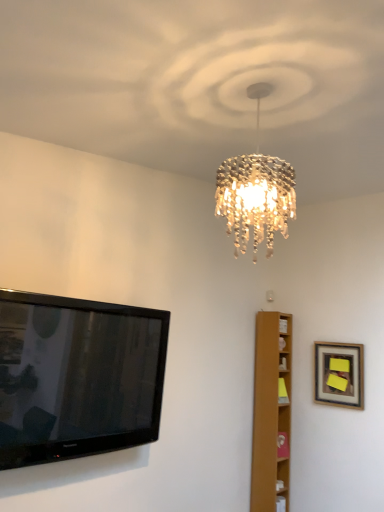
Question: Would you say wooden framed picture at upper right contains light brown wooden bookshelf at right?

Choices:
 (A) yes
 (B) no

Answer: (B)

Question: Is wooden framed picture at upper right aimed at light brown wooden bookshelf at right?

Choices:
 (A) no
 (B) yes

Answer: (A)

Question: Is wooden framed picture at upper right to the right of light brown wooden bookshelf at right from the viewer's perspective?

Choices:
 (A) yes
 (B) no

Answer: (A)

Question: From a real-world perspective, is wooden framed picture at upper right on light brown wooden bookshelf at right?

Choices:
 (A) yes
 (B) no

Answer: (A)

Question: Can you confirm if wooden framed picture at upper right is thinner than light brown wooden bookshelf at right?

Choices:
 (A) yes
 (B) no

Answer: (A)

Question: Looking at the image, does light brown wooden bookshelf at right seem bigger or smaller compared to black glossy flat-screen tv at left?

Choices:
 (A) small
 (B) big

Answer: (A)

Question: Is point 276,477 closer or farther from the camera than point 66,382?

Choices:
 (A) closer
 (B) farther

Answer: (A)

Question: In terms of width, does light brown wooden bookshelf at right look wider or thinner when compared to black glossy flat-screen tv at left?

Choices:
 (A) wide
 (B) thin

Answer: (A)

Question: Considering the relative positions of light brown wooden bookshelf at right and black glossy flat-screen tv at left in the image provided, is light brown wooden bookshelf at right to the left or to the right of black glossy flat-screen tv at left?

Choices:
 (A) right
 (B) left

Answer: (A)

Question: Relative to light brown wooden bookshelf at right, is wooden framed picture at upper right in front or behind?

Choices:
 (A) front
 (B) behind

Answer: (A)

Question: Does point (327, 391) appear closer or farther from the camera than point (271, 442)?

Choices:
 (A) farther
 (B) closer

Answer: (A)

Question: Considering the positions of wooden framed picture at upper right and light brown wooden bookshelf at right in the image, is wooden framed picture at upper right taller or shorter than light brown wooden bookshelf at right?

Choices:
 (A) short
 (B) tall

Answer: (A)

Question: In terms of width, does wooden framed picture at upper right look wider or thinner when compared to light brown wooden bookshelf at right?

Choices:
 (A) wide
 (B) thin

Answer: (B)

Question: Relative to wooden framed picture at upper right, is light brown wooden bookshelf at right in front or behind?

Choices:
 (A) front
 (B) behind

Answer: (B)

Question: Considering the relative positions of light brown wooden bookshelf at right and wooden framed picture at upper right in the image provided, is light brown wooden bookshelf at right to the left or to the right of wooden framed picture at upper right?

Choices:
 (A) left
 (B) right

Answer: (A)